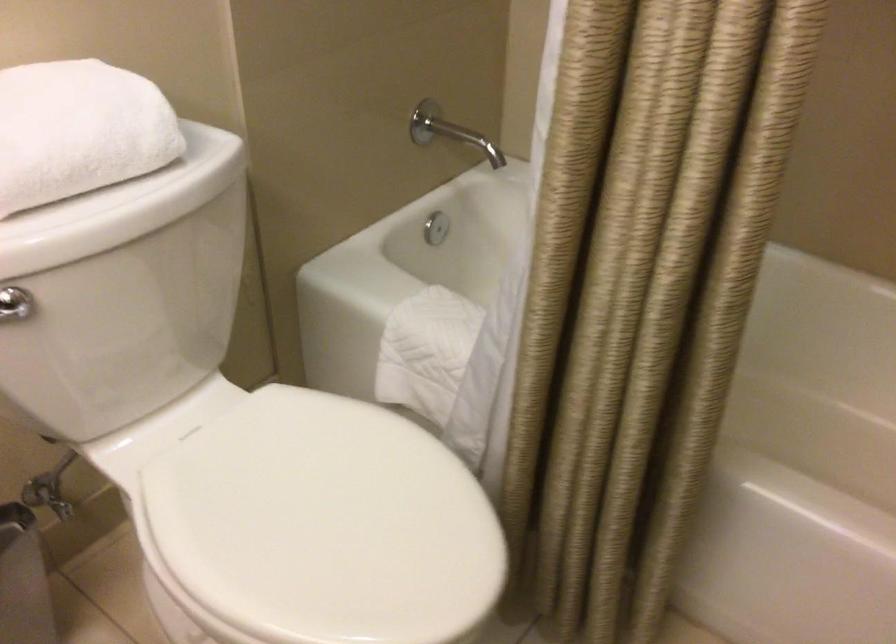
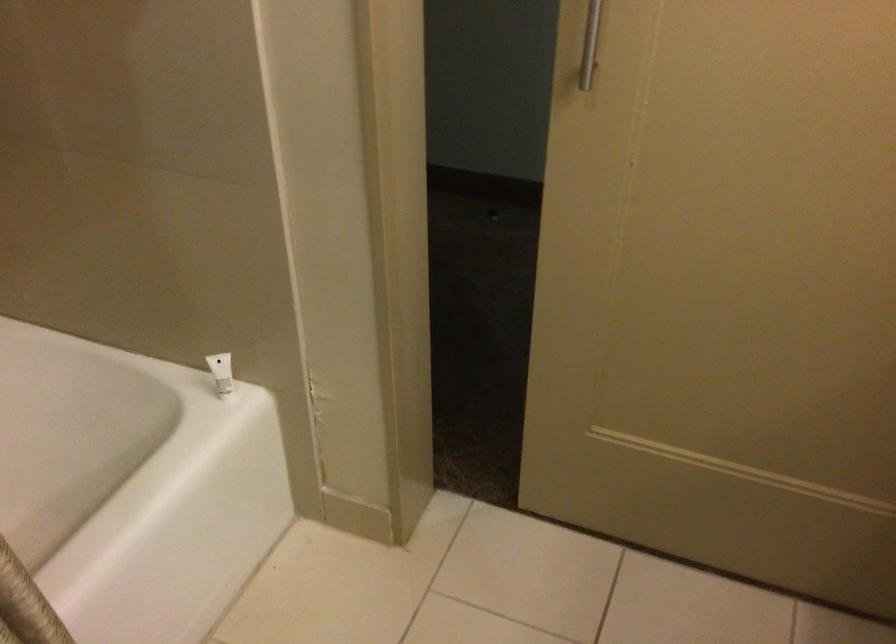
The images are taken continuously from a first-person perspective. In which direction is your viewpoint rotating?

The camera rotated toward right-down.